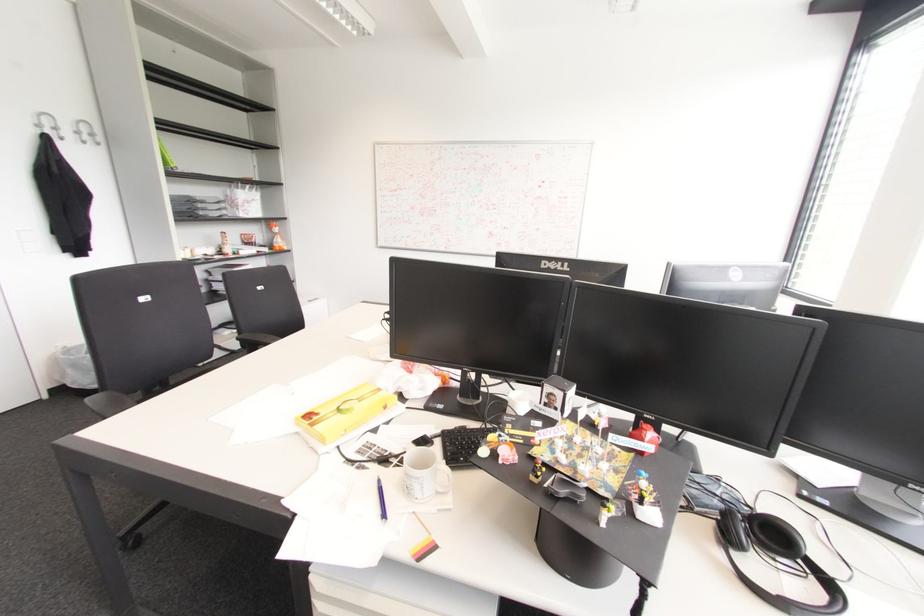
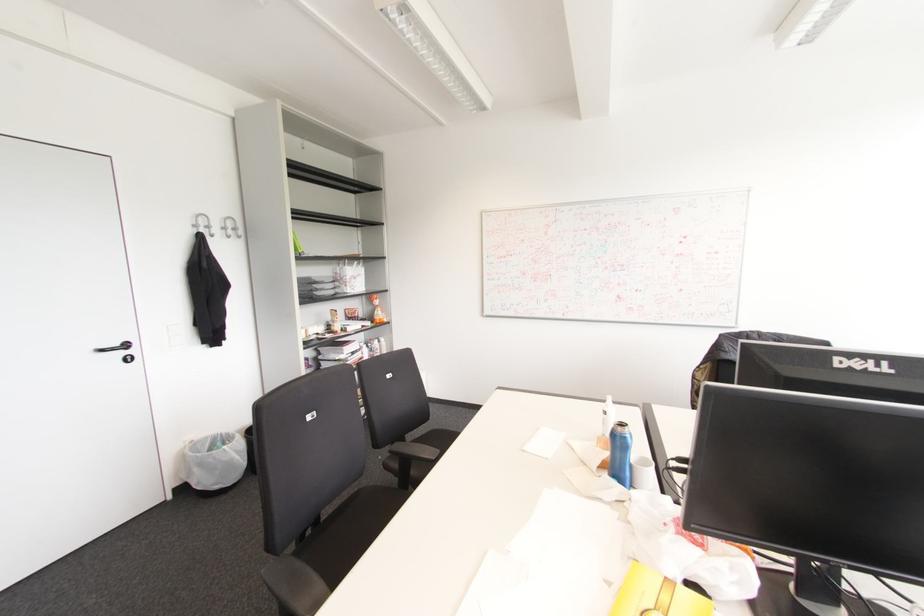
In the second image, find the point that corresponds to (x=38, y=126) in the first image.

(195, 225)